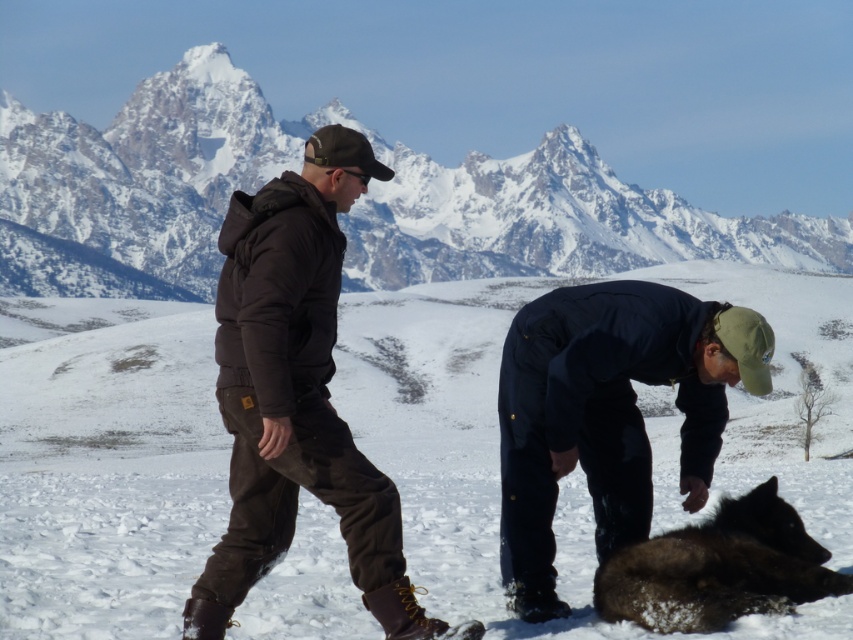
Question: Does white fluffy snow at center have a smaller size compared to dark brown fur at lower right?

Choices:
 (A) yes
 (B) no

Answer: (B)

Question: Is matte black jacket at center smaller than dark blue fabric jacket at lower right?

Choices:
 (A) no
 (B) yes

Answer: (A)

Question: Which of these objects is positioned farthest from the snowy granite mountain at upper center?

Choices:
 (A) dark brown fur at lower right
 (B) dark blue fabric jacket at lower right
 (C) white fluffy snow at center

Answer: (A)

Question: Among these points, which one is nearest to the camera?

Choices:
 (A) (701, 449)
 (B) (149, 432)

Answer: (A)

Question: Which object appears farthest from the camera in this image?

Choices:
 (A) snowy granite mountain at upper center
 (B) dark brown fur at lower right
 (C) white fluffy snow at center
 (D) matte black jacket at center

Answer: (A)

Question: Can you confirm if matte black jacket at center is bigger than dark brown fur at lower right?

Choices:
 (A) yes
 (B) no

Answer: (A)